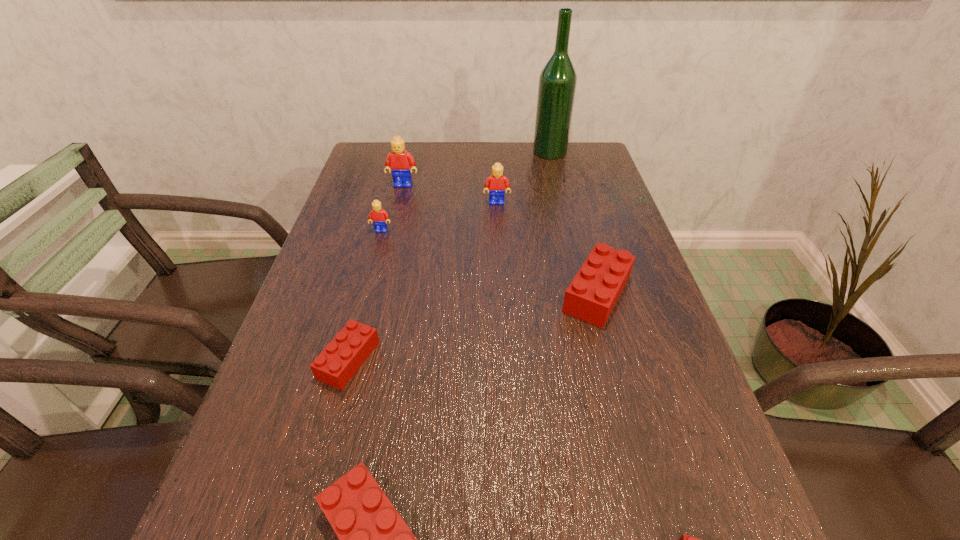
Find the location of a particular element. This screenshot has height=540, width=960. Lego positioned at the right edge is located at coordinates (591, 296).

At what (x,y) coordinates should I click in order to perform the action: click on object situated at the far right corner. Please return your answer as a coordinate pair (x, y). Image resolution: width=960 pixels, height=540 pixels. Looking at the image, I should click on (557, 84).

At what (x,y) coordinates should I click in order to perform the action: click on free region at the far edge. Please return your answer as a coordinate pair (x, y). This screenshot has width=960, height=540. Looking at the image, I should click on (460, 142).

I want to click on vacant space at the left edge of the desktop, so click(x=267, y=404).

I want to click on vacant space at the right edge of the desktop, so click(x=687, y=363).

I want to click on vacant space at the far left corner, so click(374, 144).

I want to click on free space at the far right corner of the desktop, so click(555, 175).

At what (x,y) coordinates should I click in order to perform the action: click on free spot between the third tallest Lego and the seventh tallest object. Please return your answer as a coordinate pair (x, y). Looking at the image, I should click on (365, 295).

Where is `free space between the sixth nearest Lego and the farthest object`? This screenshot has height=540, width=960. free space between the sixth nearest Lego and the farthest object is located at coordinates (523, 177).

Locate an element on the screen. free area in between the third farthest object and the second shortest Lego is located at coordinates (422, 281).